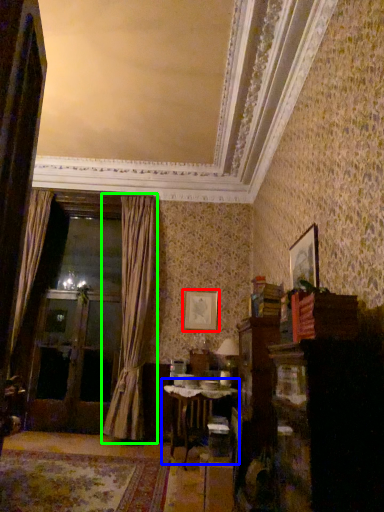
Question: Which is nearer to the picture frame (highlighted by a red box)? table (highlighted by a blue box) or curtain (highlighted by a green box).

Choices:
 (A) table
 (B) curtain

Answer: (B)